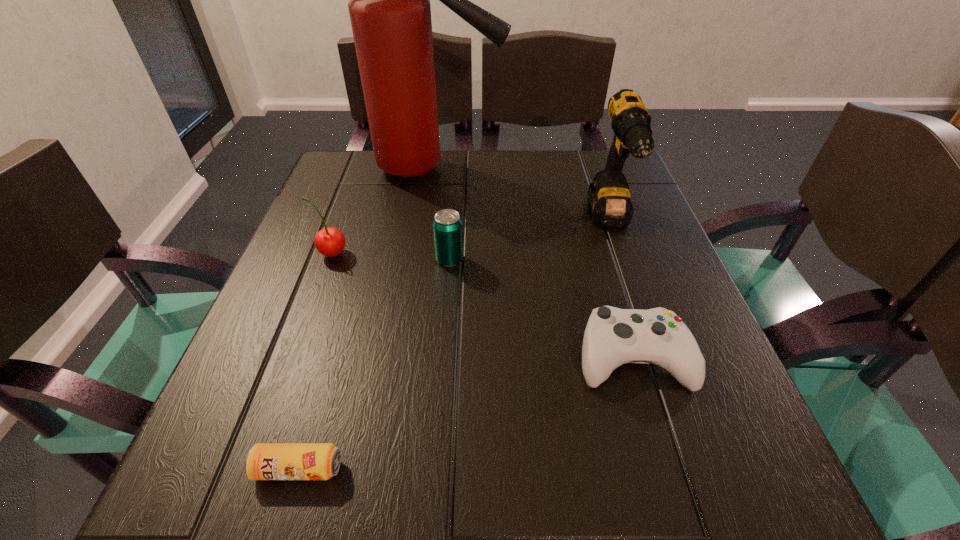
This screenshot has width=960, height=540. I want to click on cherry present at the left edge, so click(330, 242).

Find the location of a particular element. beer can at the left edge is located at coordinates (264, 461).

Where is `drill at the right edge`? This screenshot has height=540, width=960. drill at the right edge is located at coordinates (608, 197).

Image resolution: width=960 pixels, height=540 pixels. Find the location of `control located in the right edge section of the desktop`. control located in the right edge section of the desktop is located at coordinates (613, 336).

What are the coordinates of `object that is at the far left corner` in the screenshot? It's located at (390, 13).

The height and width of the screenshot is (540, 960). Find the location of `object at the near left corner`. object at the near left corner is located at coordinates (264, 461).

Locate an element on the screen. object that is at the far right corner is located at coordinates (608, 197).

Where is `free point at the far edge`? The image size is (960, 540). free point at the far edge is located at coordinates (458, 161).

Locate an element on the screen. Image resolution: width=960 pixels, height=540 pixels. vacant space at the near edge of the desktop is located at coordinates (368, 490).

Where is `free space at the left edge`? This screenshot has height=540, width=960. free space at the left edge is located at coordinates (322, 336).